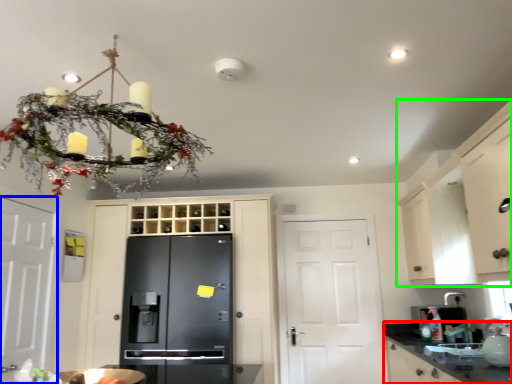
Question: Which object is positioned closest to countertop (highlighted by a red box)? Select from door (highlighted by a blue box) and cabinetry (highlighted by a green box).

Choices:
 (A) door
 (B) cabinetry

Answer: (B)